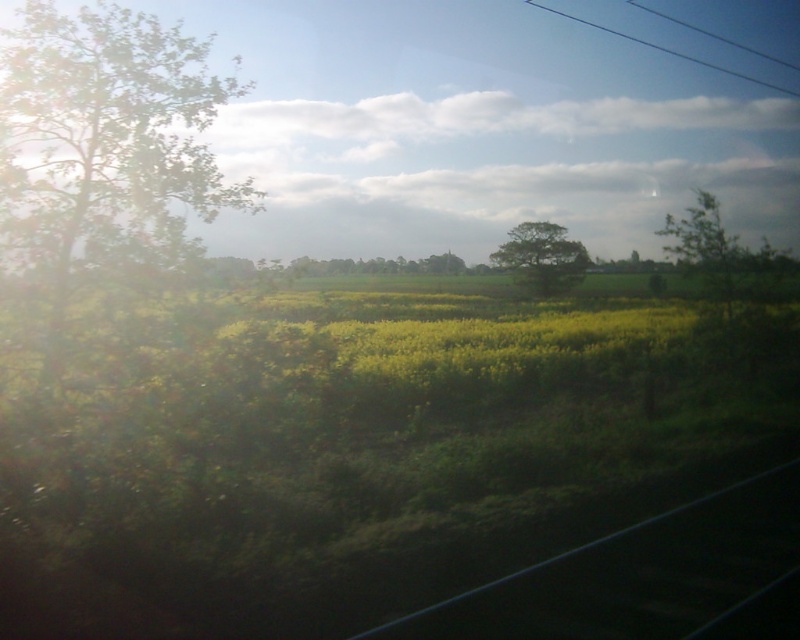
As a passenger on the train, you notice two points in the scene. The first is at coordinate point [165,250] and the second at point [688,250]. Which of these points is closer to you, the observer?

Point [165,250] is closer to you because it is in front of point [688,250].

You are a passenger on a train and you see the green leafy tree at left and the black metal train track at lower right through the window. Which object is closer to the left side of the window?

The green leafy tree at left is closer to the left side of the window than the black metal train track at lower right.

You are a passenger on a train passing through this landscape. You notice a point marked at coordinates (104, 141) on your window. What object does this point correspond to?

The point at coordinates (104, 141) corresponds to the green leafy tree at left.